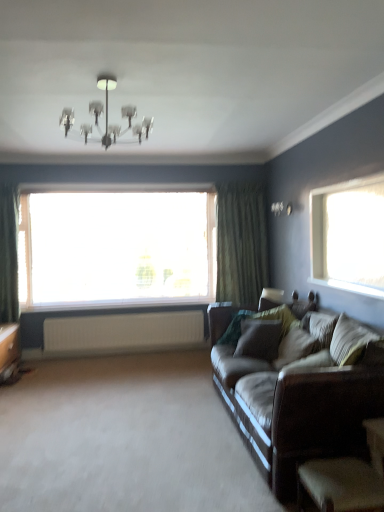
Identify the location of free location above metallic chandelier at upper center (from a real-world perspective). tap(113, 79).